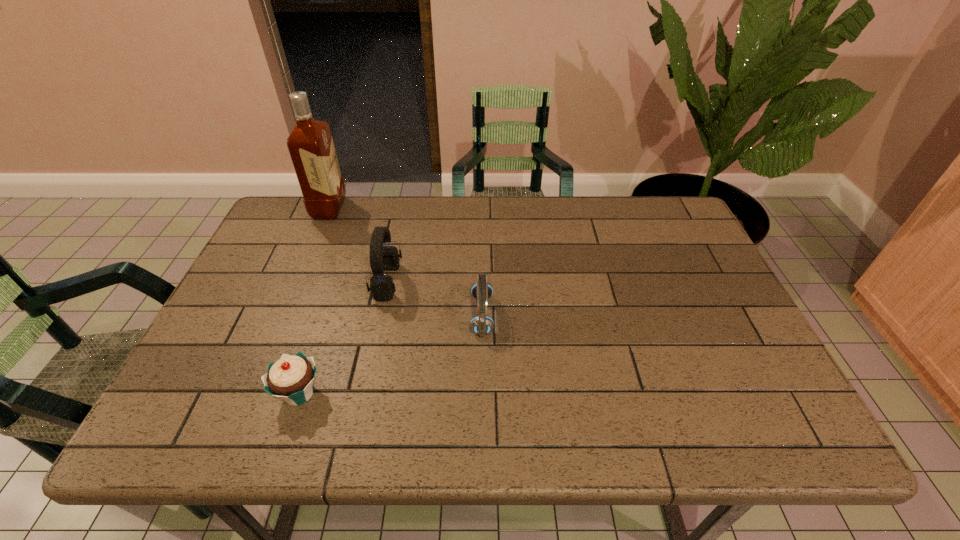
At what (x,y) coordinates should I click in order to perform the action: click on the farthest object. Please return your answer as a coordinate pair (x, y). Looking at the image, I should click on (310, 144).

At what (x,y) coordinates should I click in order to perform the action: click on liquor. Please return your answer as a coordinate pair (x, y). The width and height of the screenshot is (960, 540). Looking at the image, I should click on (310, 144).

The image size is (960, 540). In order to click on the taller headset in this screenshot , I will do `click(382, 258)`.

You are a GUI agent. You are given a task and a screenshot of the screen. Output one action in this format:
    pyautogui.click(x=<x>, y=<y>)
    Task: Click on the left headset
    The width and height of the screenshot is (960, 540).
    Given the screenshot: What is the action you would take?
    pyautogui.click(x=382, y=258)

Where is `cupcake`? The height and width of the screenshot is (540, 960). cupcake is located at coordinates (291, 378).

Identify the location of the third object from right to left. The image size is (960, 540). (291, 378).

At what (x,y) coordinates should I click in order to perform the action: click on the right headset. Please return your answer as a coordinate pair (x, y). This screenshot has width=960, height=540. Looking at the image, I should click on (482, 324).

Where is `the rightmost object`? the rightmost object is located at coordinates (482, 324).

Where is `free space located 0.050m on the front label of the farthest object`? free space located 0.050m on the front label of the farthest object is located at coordinates (359, 209).

Find the location of a particular element. This screenshot has height=540, width=960. free location located 0.150m on the headband of the taller headset is located at coordinates (457, 282).